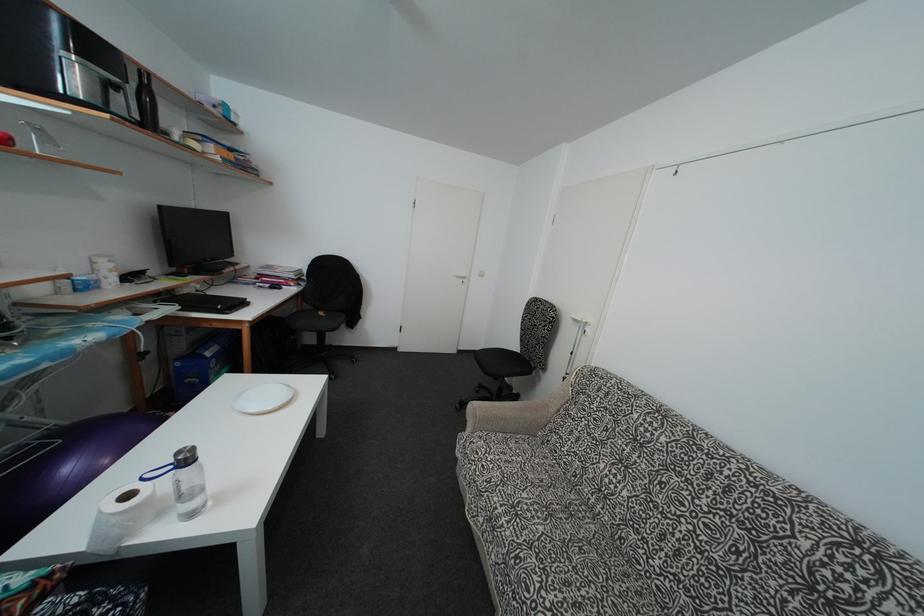
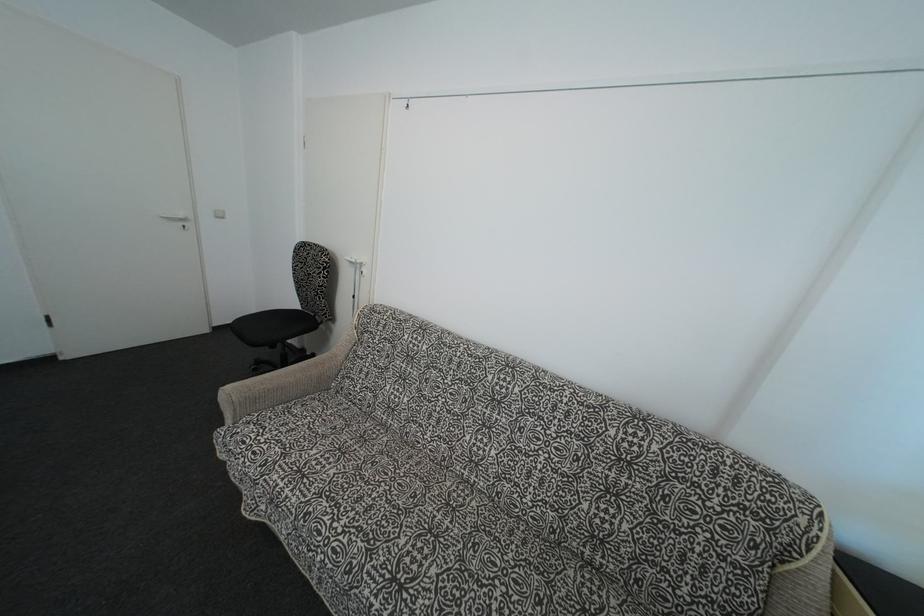
The point at (517, 353) is marked in the first image. Where is the corresponding point in the second image?

(297, 310)